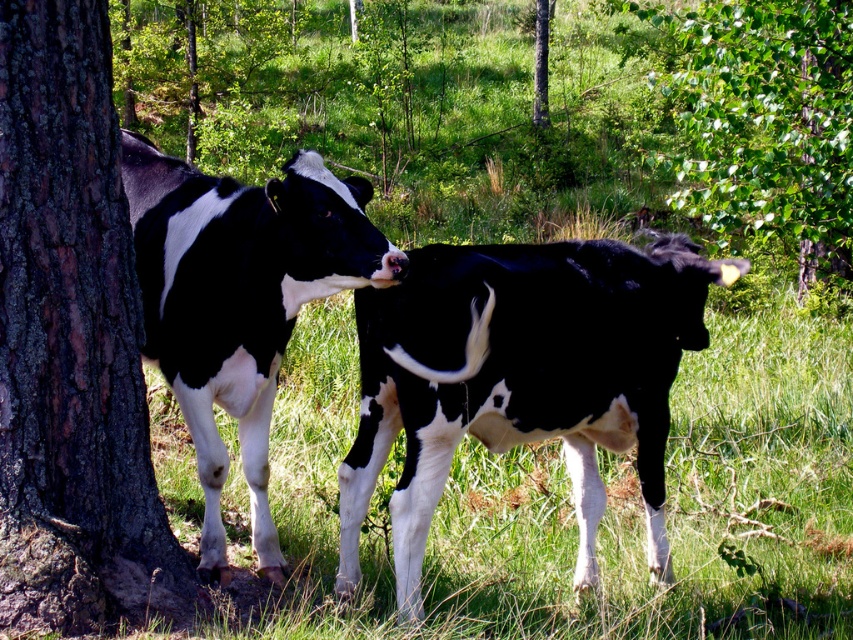
You are a photographer wanting to capture both the black and white spotted cow at left and the green leafy tree at upper right in the same frame. Based on their positions, which one is positioned more to the left side of the image?

The black and white spotted cow at left is positioned more to the left side of the image than the green leafy tree at upper right.

You are standing in the middle of the grassy area and want to walk to the brown rough tree trunk at left. Which direction should you head towards?

The brown rough tree trunk at left is located at point 0.537 on the x axis and 0.084 on the y axis. Since you are in the middle of the grassy area, you should head towards the left direction to reach the brown rough tree trunk at left.